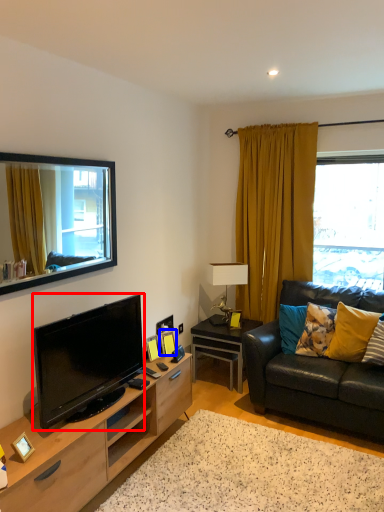
Question: Which object appears farthest to the camera in this image, television (highlighted by a red box) or picture frame (highlighted by a blue box)?

Choices:
 (A) television
 (B) picture frame

Answer: (B)